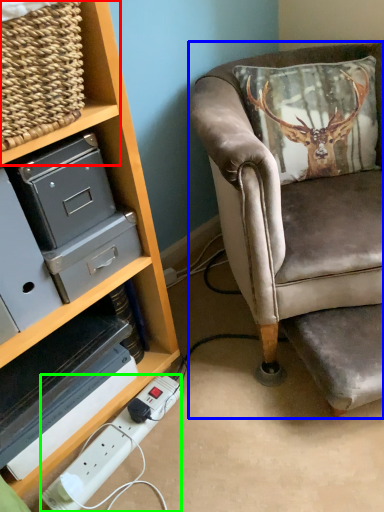
Question: Considering the real-world distances, which object is closest to shelf (highlighted by a red box)? chair (highlighted by a blue box) or extension cord (highlighted by a green box).

Choices:
 (A) chair
 (B) extension cord

Answer: (A)